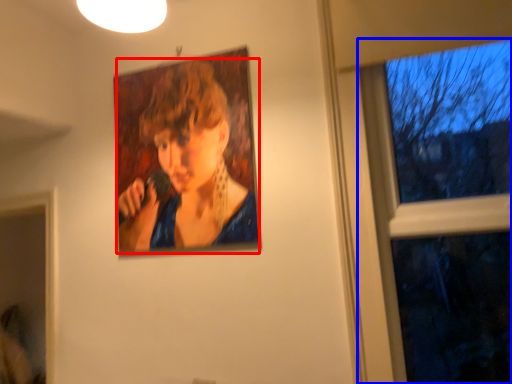
Question: Which point is further to the camera, person (highlighted by a red box) or window (highlighted by a blue box)?

Choices:
 (A) person
 (B) window

Answer: (A)